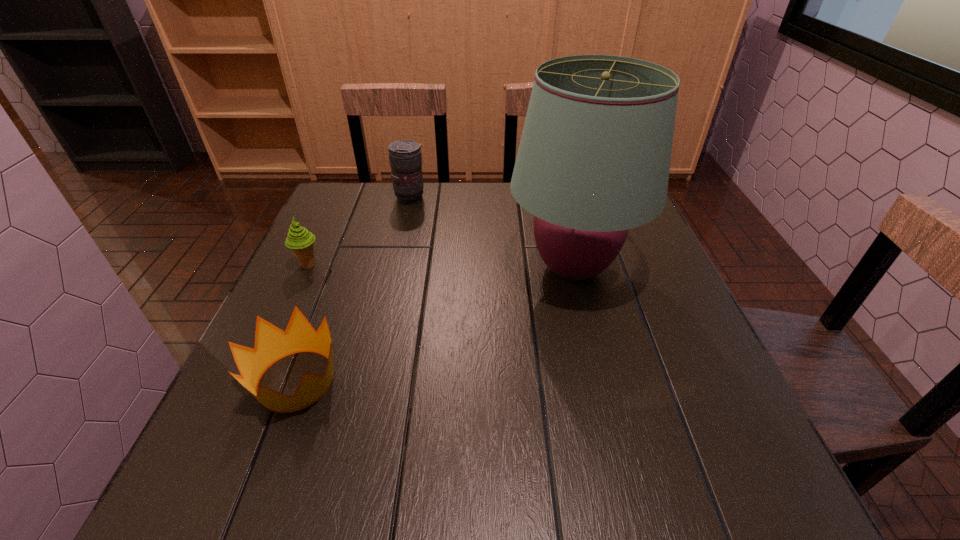
This screenshot has width=960, height=540. In order to click on lampshade in this screenshot , I will do `click(594, 157)`.

I want to click on the tallest object, so click(x=594, y=157).

Find the location of a particular element. the second tallest object is located at coordinates (405, 158).

Where is `telephoto lens`? telephoto lens is located at coordinates (405, 158).

Image resolution: width=960 pixels, height=540 pixels. Find the location of `icecream`. icecream is located at coordinates (301, 242).

Find the location of `the shortest object`. the shortest object is located at coordinates (271, 343).

Where is `crown`? The image size is (960, 540). crown is located at coordinates (271, 343).

I want to click on vacant region located 0.150m on the front of the lampshade, so click(x=599, y=374).

Identify the location of vacant space positioned on the side of the second tallest object where the control switches are located. (463, 199).

Locate an element on the screen. This screenshot has width=960, height=540. vacant space situated on the front of the icecream is located at coordinates (272, 346).